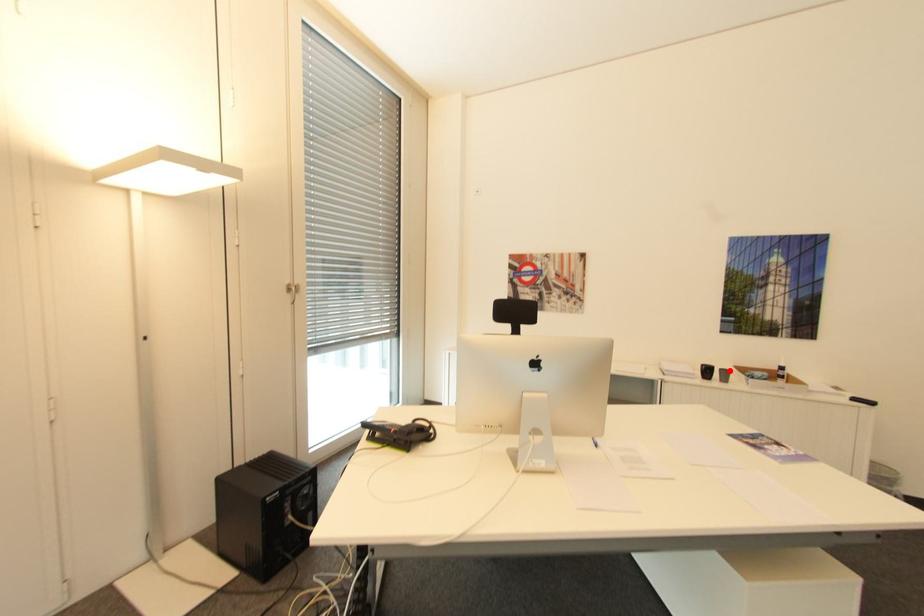
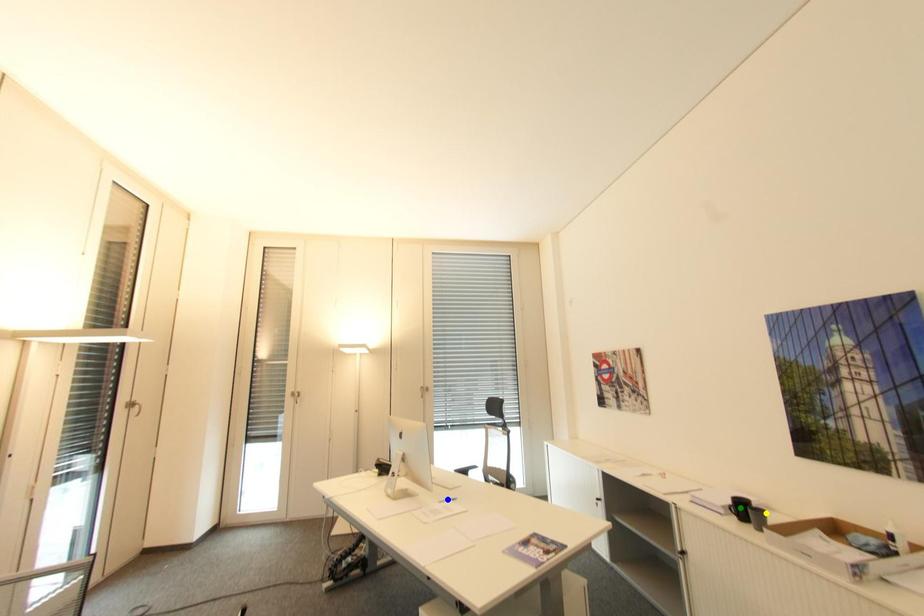
Question: I am providing you with two images of the same scene from different viewpoints. A red point is marked on the first image. You are given multiple points on the second image. Which point in image 2 is actually the same real-world point as the red point in image 1?

Choices:
 (A) green point
 (B) blue point
 (C) yellow point

Answer: (C)